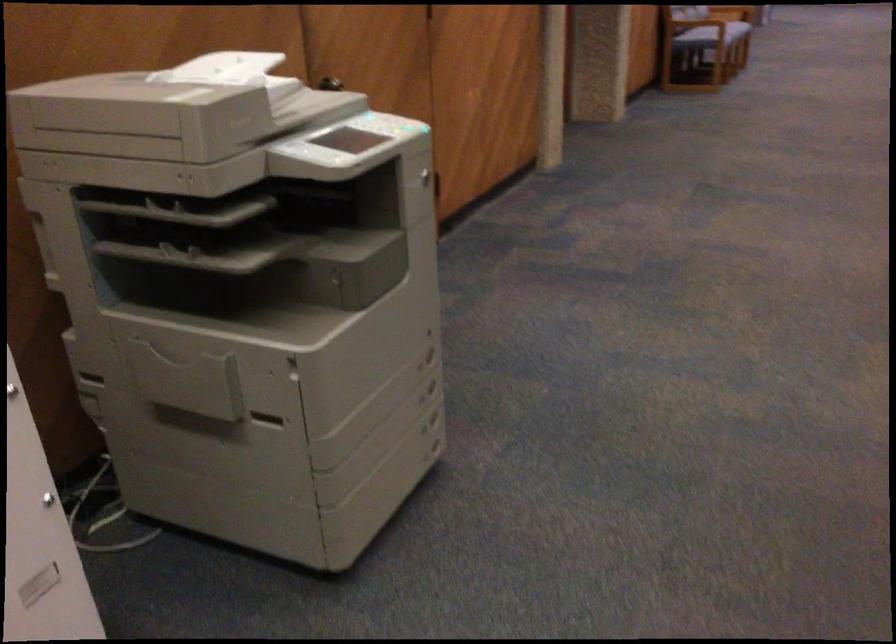
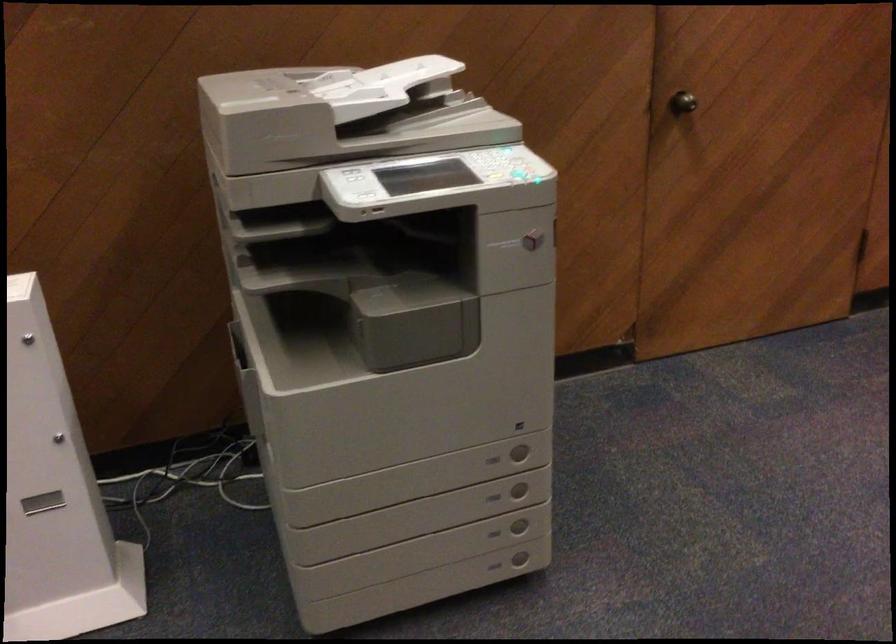
Locate, in the second image, the point that corresponds to (x=443, y=450) in the first image.

(520, 559)